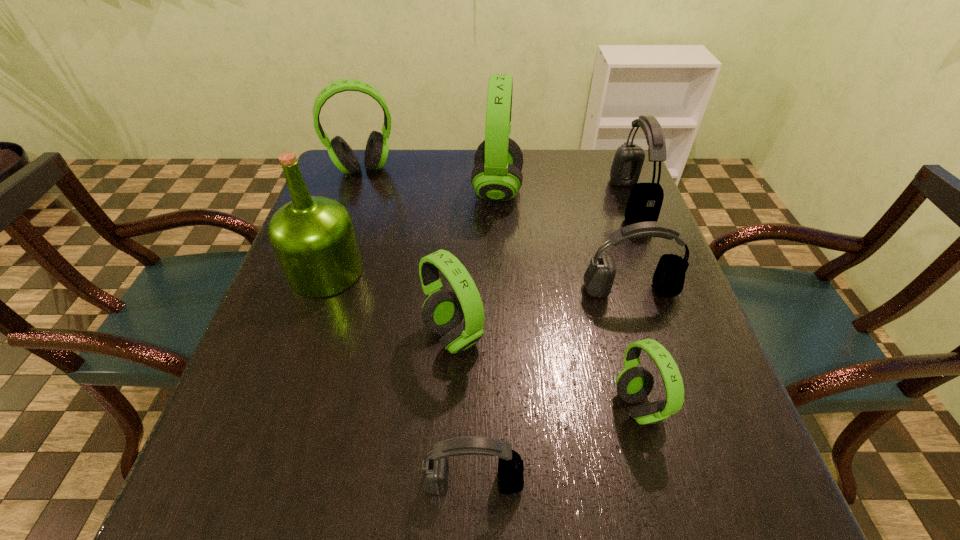
This screenshot has width=960, height=540. What are the coordinates of `the second nearest object` in the screenshot? It's located at (634, 384).

Identify the location of the nearest headset. The image size is (960, 540). (435, 468).

Where is `the leftmost black headset`? the leftmost black headset is located at coordinates point(435,468).

This screenshot has width=960, height=540. I want to click on vacant space positioned 0.080m on the right of the biggest green headset, so click(x=552, y=190).

Identify the location of vacant region located on the front of the olive oil. This screenshot has height=540, width=960. (303, 337).

The image size is (960, 540). Identify the location of free space located 0.330m on the right of the third smallest green headset. (511, 170).

I want to click on free space located 0.090m on the headband of the biggest black headset, so click(x=583, y=202).

The height and width of the screenshot is (540, 960). I want to click on free space located on the headband of the biggest black headset, so click(504, 202).

Find the location of a particular element. vacant space located 0.070m on the headband of the biggest black headset is located at coordinates (590, 202).

Find the location of a particular element. vacant area situated 0.390m on the right of the third nearest object is located at coordinates (681, 336).